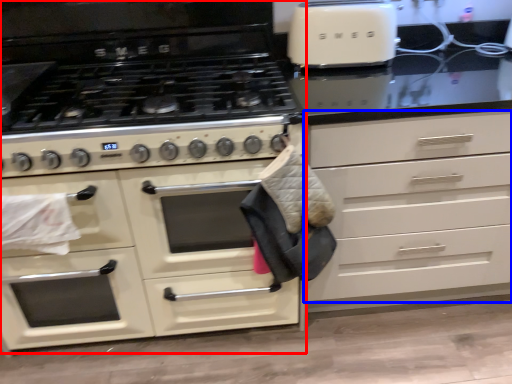
Question: Which object appears closest to the camera in this image, cabinetry (highlighted by a red box) or drawer (highlighted by a blue box)?

Choices:
 (A) cabinetry
 (B) drawer

Answer: (B)